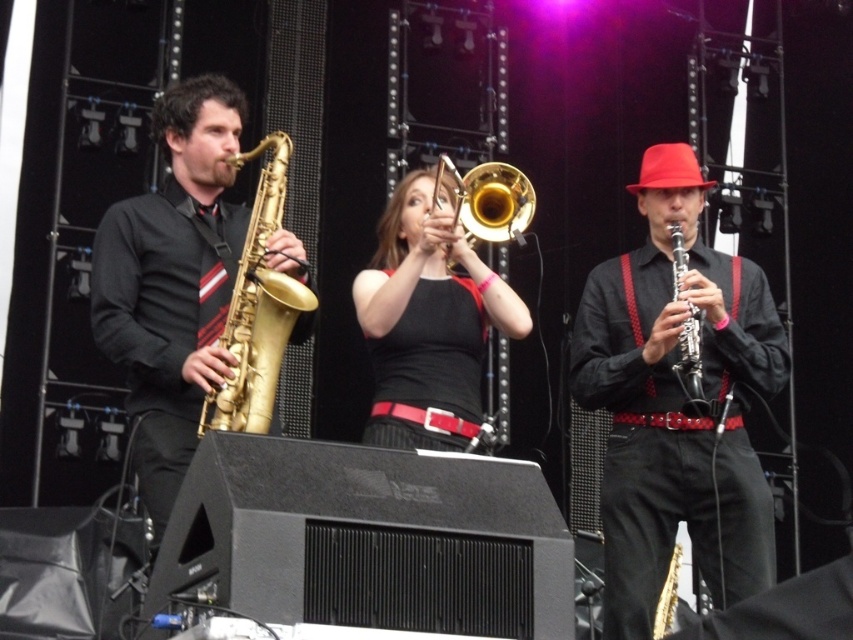
Question: Which is farther from the shiny black clarinet at center?

Choices:
 (A) gold shiny trumpet at center
 (B) gold brass trumpet at center
 (C) gold shiny trombone at center
 (D) gold lacquered saxophone at left

Answer: (D)

Question: Which of these objects is positioned closest to the black wood clarinet at center?

Choices:
 (A) gold shiny trombone at center
 (B) shiny black clarinet at center

Answer: (B)

Question: Which point appears farthest from the camera in this image?

Choices:
 (A) (685, 250)
 (B) (717, 461)

Answer: (A)

Question: Is gold shiny trumpet at center bigger than black wood clarinet at center?

Choices:
 (A) no
 (B) yes

Answer: (B)

Question: Does gold lacquered saxophone at left appear on the right side of gold brass trumpet at center?

Choices:
 (A) no
 (B) yes

Answer: (A)

Question: Does shiny black clarinet at center have a larger size compared to gold shiny trumpet at center?

Choices:
 (A) yes
 (B) no

Answer: (A)